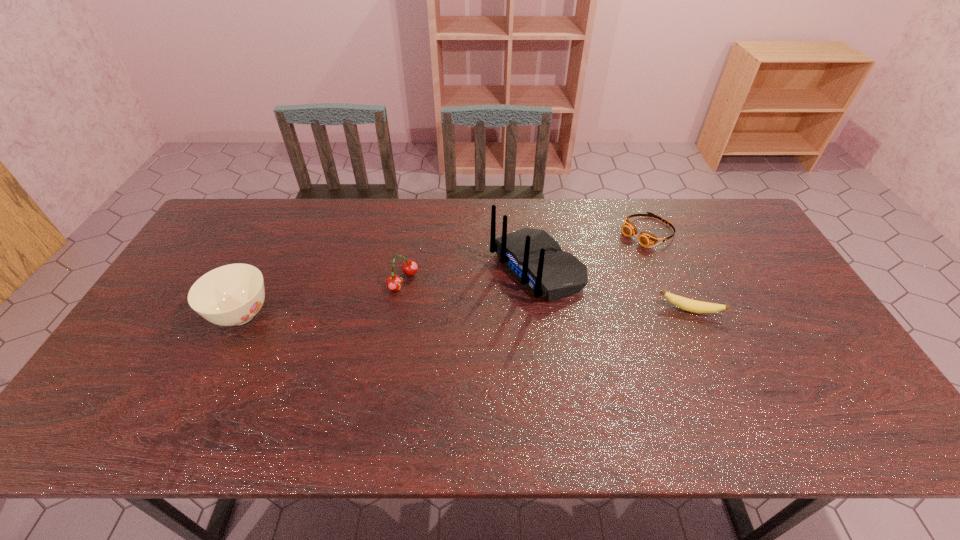
Locate an element on the screen. vacant area that lies between the sugar bowl and the third object from right to left is located at coordinates (389, 292).

The width and height of the screenshot is (960, 540). I want to click on empty space between the router and the leftmost object, so click(x=389, y=292).

Image resolution: width=960 pixels, height=540 pixels. Identify the location of object that is the second closest to the goggles. (687, 304).

Locate an element on the screen. the closest object to the goggles is located at coordinates [x=535, y=259].

Locate an element on the screen. The image size is (960, 540). blank area in the image that satisfies the following two spatial constraints: 1. on the back side of the sugar bowl; 2. on the right side of the cherry is located at coordinates (259, 281).

You are a GUI agent. You are given a task and a screenshot of the screen. Output one action in this format:
    pyautogui.click(x=<x>, y=<y>)
    Task: Click on the vacant space that satisfies the following two spatial constraints: 1. on the back side of the second object from left to right; 2. on the left side of the sugar bowl
    This screenshot has height=540, width=960.
    Given the screenshot: What is the action you would take?
    (x=259, y=281)

I want to click on blank space that satisfies the following two spatial constraints: 1. on the back side of the leftmost object; 2. on the right side of the banana, so click(245, 310).

Where is `free region that satisfies the following two spatial constraints: 1. on the back side of the tallest object; 2. on the right side of the goggles`? free region that satisfies the following two spatial constraints: 1. on the back side of the tallest object; 2. on the right side of the goggles is located at coordinates (532, 231).

Where is `vacant region that satisfies the following two spatial constraints: 1. on the back side of the goggles; 2. on the left side of the fourth object from right to left`? This screenshot has width=960, height=540. vacant region that satisfies the following two spatial constraints: 1. on the back side of the goggles; 2. on the left side of the fourth object from right to left is located at coordinates [412, 231].